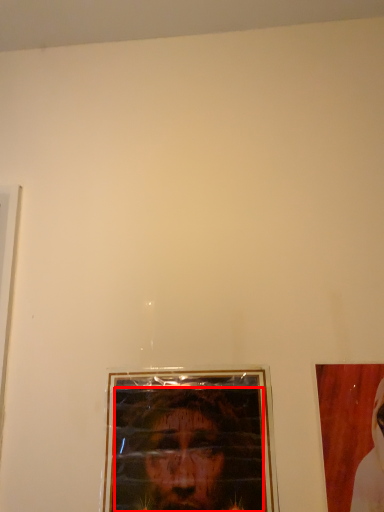
Question: From the image's perspective, where is man (annotated by the red box) located relative to picture frame?

Choices:
 (A) above
 (B) below

Answer: (B)